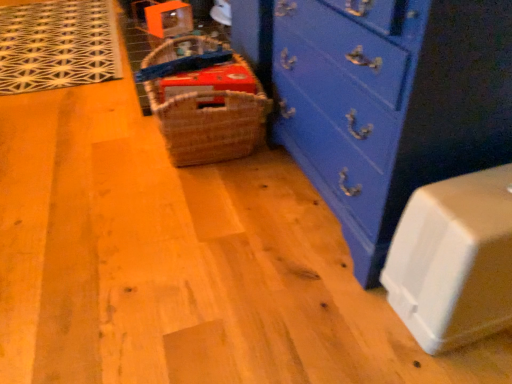
The image size is (512, 384). What do you see at coordinates (210, 113) in the screenshot?
I see `woven brown basket at center` at bounding box center [210, 113].

Find the location of `white plastic container at lower right`. white plastic container at lower right is located at coordinates (454, 260).

At what (x,y) coordinates should I click in order to perform the action: click on woven brown basket at center. Please return your answer as a coordinate pair (x, y). Looking at the image, I should click on (210, 113).

I want to click on the chest of drawers that is above the white plastic container at lower right (from a real-world perspective), so click(x=390, y=103).

Considering the sizes of blue painted wood chest of drawers at center and white plastic container at lower right in the image, is blue painted wood chest of drawers at center taller or shorter than white plastic container at lower right?

Clearly, blue painted wood chest of drawers at center is taller compared to white plastic container at lower right.

Considering the relative positions of blue painted wood chest of drawers at center and white plastic container at lower right in the image provided, is blue painted wood chest of drawers at center to the left of white plastic container at lower right from the viewer's perspective?

Correct, you'll find blue painted wood chest of drawers at center to the left of white plastic container at lower right.

Which object is closer to the camera taking this photo, blue painted wood chest of drawers at center or white plastic container at lower right?

white plastic container at lower right.

Which is behind, point (419, 219) or point (301, 9)?

The point (301, 9) is behind.

Does white plastic container at lower right turn towards blue painted wood chest of drawers at center?

No, white plastic container at lower right is not aimed at blue painted wood chest of drawers at center.

Considering the sizes of objects white plastic container at lower right and blue painted wood chest of drawers at center in the image provided, who is bigger, white plastic container at lower right or blue painted wood chest of drawers at center?

blue painted wood chest of drawers at center is bigger.

Is blue painted wood chest of drawers at center not close to woven brown basket at center?

blue painted wood chest of drawers at center is near woven brown basket at center, not far away.

What are the coordinates of `basket above the blue painted wood chest of drawers at center (from the image's perspective)` in the screenshot? It's located at (210, 113).

From a real-world perspective, relative to woven brown basket at center, is blue painted wood chest of drawers at center vertically above or below?

Clearly, from a real-world perspective, blue painted wood chest of drawers at center is above woven brown basket at center.

Is blue painted wood chest of drawers at center completely or partially outside of woven brown basket at center?

Indeed, blue painted wood chest of drawers at center is completely outside woven brown basket at center.

Where is `basket that is behind the blue painted wood chest of drawers at center`? basket that is behind the blue painted wood chest of drawers at center is located at coordinates (210, 113).

Which is more to the left, woven brown basket at center or blue painted wood chest of drawers at center?

From the viewer's perspective, woven brown basket at center appears more on the left side.

Is woven brown basket at center surrounding blue painted wood chest of drawers at center?

No.

Considering the sizes of woven brown basket at center and blue painted wood chest of drawers at center in the image, is woven brown basket at center taller or shorter than blue painted wood chest of drawers at center?

Considering their sizes, woven brown basket at center has less height than blue painted wood chest of drawers at center.

Is the surface of white plastic container at lower right in direct contact with woven brown basket at center?

They are not placed beside each other.

Is white plastic container at lower right aimed at woven brown basket at center?

No, white plastic container at lower right does not turn towards woven brown basket at center.

Is white plastic container at lower right spatially inside woven brown basket at center, or outside of it?

The correct answer is: outside.

From the image's perspective, would you say white plastic container at lower right is shown under woven brown basket at center?

Yes.

Between woven brown basket at center and white plastic container at lower right, which one has smaller size?

With smaller size is white plastic container at lower right.

Is woven brown basket at center to the left of white plastic container at lower right from the viewer's perspective?

Indeed, woven brown basket at center is positioned on the left side of white plastic container at lower right.

Considering the points (230, 110) and (485, 324), which point is in front, point (230, 110) or point (485, 324)?

The point (485, 324) is closer to the camera.

Where is `the chest of drawers located behind the white plastic container at lower right`? Image resolution: width=512 pixels, height=384 pixels. the chest of drawers located behind the white plastic container at lower right is located at coordinates (390, 103).

You are a GUI agent. You are given a task and a screenshot of the screen. Output one action in this format:
    pyautogui.click(x=<x>, y=<y>)
    Task: Click on the chest of drawers above the white plastic container at lower right (from the image's perspective)
    This screenshot has height=384, width=512.
    Given the screenshot: What is the action you would take?
    pyautogui.click(x=390, y=103)

Consider the image. When comparing their distances from blue painted wood chest of drawers at center, does white plastic container at lower right or woven brown basket at center seem closer?

Based on the image, white plastic container at lower right appears to be nearer to blue painted wood chest of drawers at center.

Based on their spatial positions, is woven brown basket at center or blue painted wood chest of drawers at center further from white plastic container at lower right?

woven brown basket at center lies further to white plastic container at lower right than the other object.

From the image, which object appears to be farther from woven brown basket at center, white plastic container at lower right or blue painted wood chest of drawers at center?

The object further to woven brown basket at center is white plastic container at lower right.

Which object lies nearer to the anchor point woven brown basket at center, blue painted wood chest of drawers at center or white plastic container at lower right?

blue painted wood chest of drawers at center is positioned closer to the anchor woven brown basket at center.

Which object lies nearer to the anchor point white plastic container at lower right, blue painted wood chest of drawers at center or woven brown basket at center?

blue painted wood chest of drawers at center is positioned closer to the anchor white plastic container at lower right.

When comparing their distances from blue painted wood chest of drawers at center, does woven brown basket at center or white plastic container at lower right seem closer?

Based on the image, white plastic container at lower right appears to be nearer to blue painted wood chest of drawers at center.

What are the coordinates of `chest of drawers between woven brown basket at center and white plastic container at lower right` in the screenshot? It's located at (390, 103).